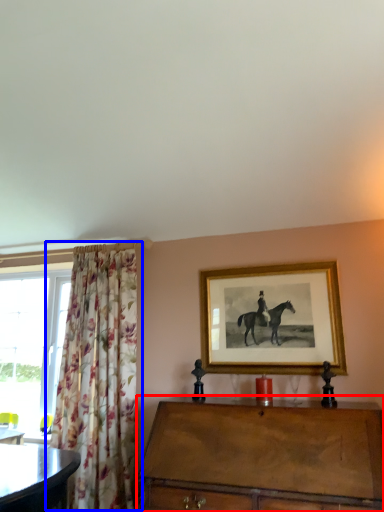
Question: Which of the following is the farthest to the observer, chest of drawers (highlighted by a red box) or curtain (highlighted by a blue box)?

Choices:
 (A) chest of drawers
 (B) curtain

Answer: (B)